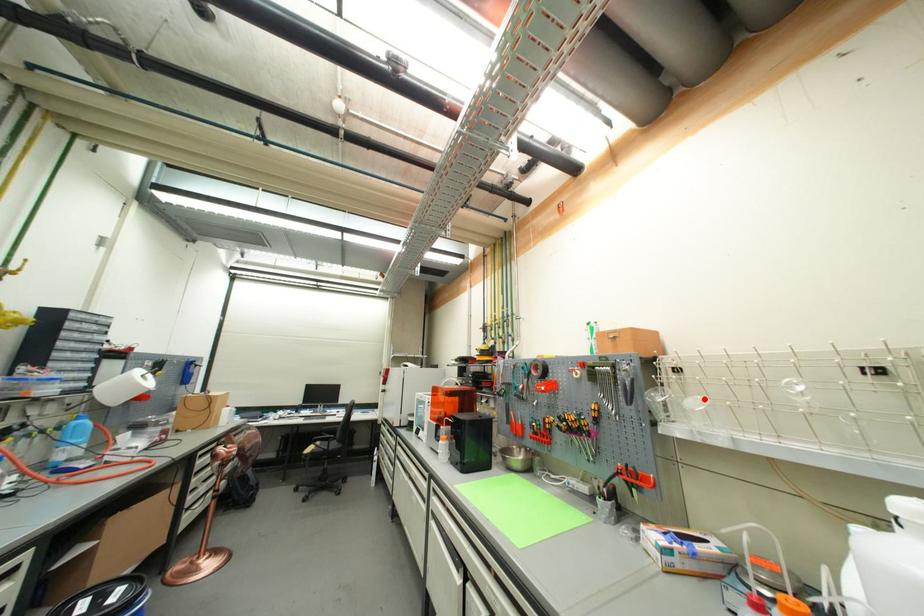
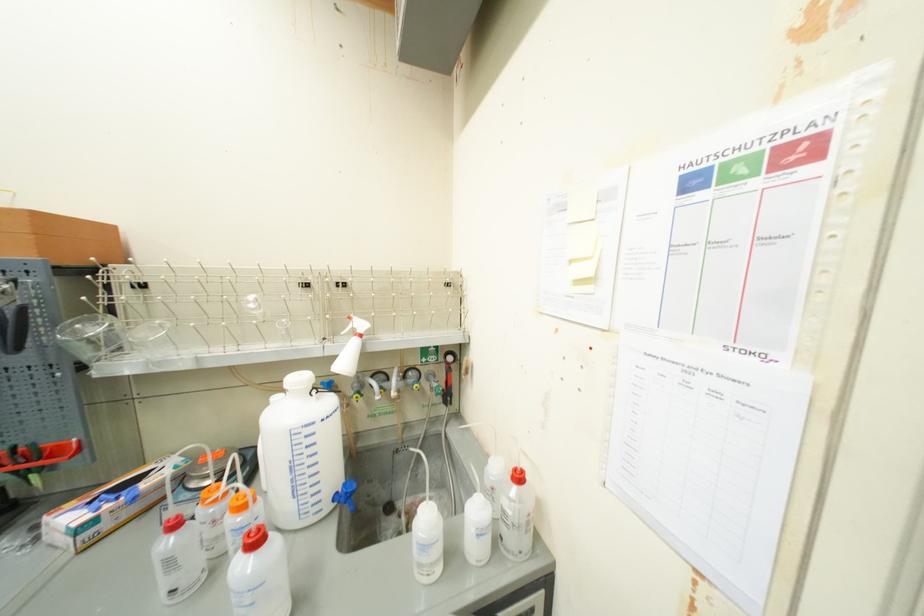
Find the pixel in the second image that matches the highlighted location in the first image.

(163, 323)